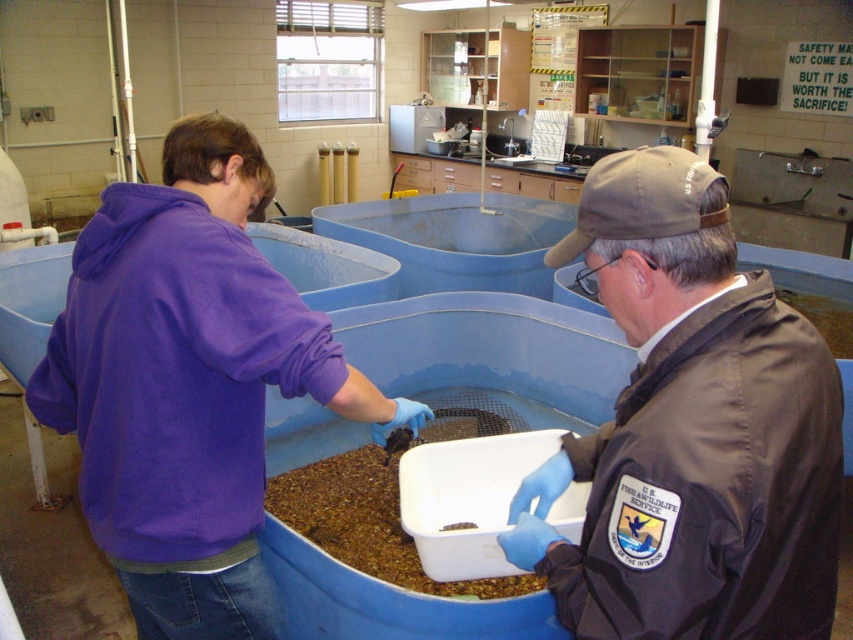
Question: Which of the following is the farthest from the observer?

Choices:
 (A) (780, 340)
 (B) (190, 595)

Answer: (B)

Question: Which of the following is the farthest from the observer?

Choices:
 (A) (314, 355)
 (B) (801, 388)

Answer: (A)

Question: From the image, what is the correct spatial relationship of brown leather jacket at center in relation to purple fleece jacket at center?

Choices:
 (A) right
 (B) left

Answer: (A)

Question: Does brown leather jacket at center have a lesser width compared to purple fleece jacket at center?

Choices:
 (A) no
 (B) yes

Answer: (B)

Question: Which point is farther to the camera?

Choices:
 (A) (778, 435)
 (B) (277, 593)

Answer: (B)

Question: Can you confirm if brown leather jacket at center is positioned to the left of purple fleece jacket at center?

Choices:
 (A) yes
 (B) no

Answer: (B)